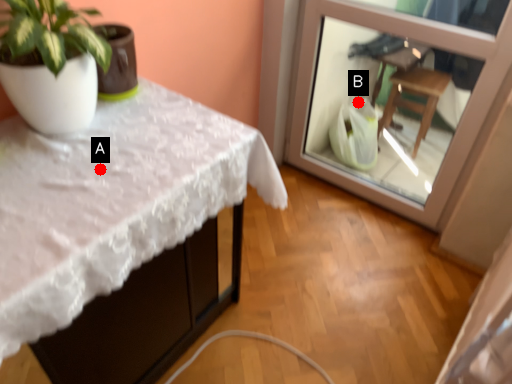
Question: Two points are circled on the image, labeled by A and B beside each circle. Which point is closer to the camera?

Choices:
 (A) A is closer
 (B) B is closer

Answer: (A)